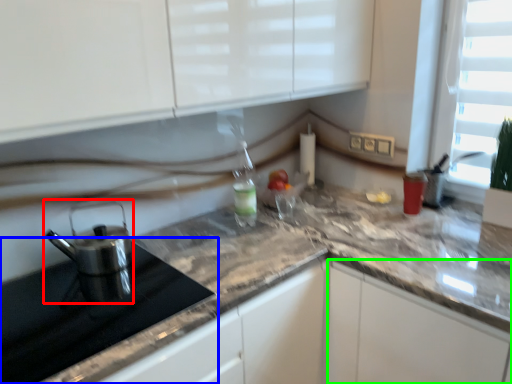
Question: Estimate the real-world distances between objects in this image. Which object is farther from kitchen appliance (highlighted by a red box), appliance (highlighted by a blue box) or cabinetry (highlighted by a green box)?

Choices:
 (A) appliance
 (B) cabinetry

Answer: (B)